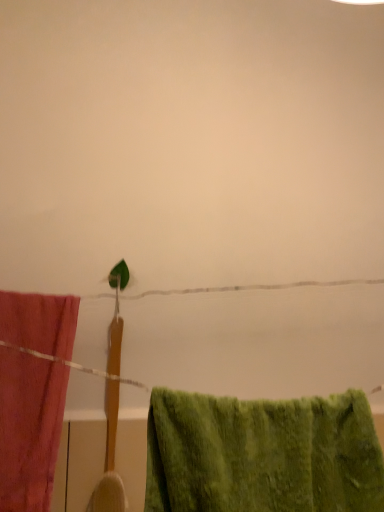
Question: From the image's perspective, is green fuzzy towel at lower right, positioned as the 2th towel in left-to-right order, located above or below matte pink towel at left, the 1th towel in the back-to-front sequence?

Choices:
 (A) above
 (B) below

Answer: (B)

Question: Considering their positions, is green fuzzy towel at lower right, which ranks as the first towel in front-to-back order, located in front of or behind matte pink towel at left, which is the first towel in left-to-right order?

Choices:
 (A) front
 (B) behind

Answer: (A)

Question: Considering the positions of point (230, 488) and point (1, 394), is point (230, 488) closer or farther from the camera than point (1, 394)?

Choices:
 (A) closer
 (B) farther

Answer: (A)

Question: Looking at their shapes, would you say matte pink towel at left, which is the first towel in left-to-right order, is wider or thinner than green fuzzy towel at lower right, which is the second towel from back to front?

Choices:
 (A) thin
 (B) wide

Answer: (A)

Question: In terms of size, does matte pink towel at left, which is the first towel in left-to-right order, appear bigger or smaller than green fuzzy towel at lower right, which ranks as the first towel in front-to-back order?

Choices:
 (A) small
 (B) big

Answer: (A)

Question: Would you say matte pink towel at left, the 1th towel in the back-to-front sequence, is to the left or to the right of green fuzzy towel at lower right, positioned as the 2th towel in left-to-right order, in the picture?

Choices:
 (A) right
 (B) left

Answer: (B)

Question: From a real-world perspective, is matte pink towel at left, which is the first towel in left-to-right order, above or below green fuzzy towel at lower right, which ranks as the first towel in front-to-back order?

Choices:
 (A) below
 (B) above

Answer: (B)